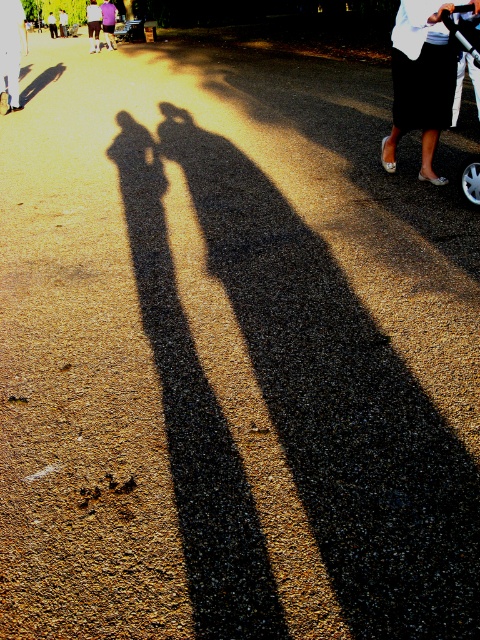
Who is positioned more to the left, black satin skirt at upper right or purple cotton shirt at upper left?

purple cotton shirt at upper left

Is black satin skirt at upper right shorter than purple cotton shirt at upper left?

Yes, black satin skirt at upper right is shorter than purple cotton shirt at upper left.

Locate an element on the screen. This screenshot has width=480, height=640. black satin skirt at upper right is located at coordinates coord(420,81).

Is point (408, 116) farther from camera compared to point (66, 13)?

No.

Consider the image. Can you confirm if black satin skirt at upper right is taller than white cotton shirt at center?

In fact, black satin skirt at upper right may be shorter than white cotton shirt at center.

Which is behind, point (428, 120) or point (63, 35)?

Point (63, 35)

This screenshot has height=640, width=480. What are the coordinates of `black satin skirt at upper right` in the screenshot? It's located at (420, 81).

Does white plastic baby carriage at upper right appear under purple cotton shirt at upper left?

Yes.

Who is more forward, (459, 22) or (92, 17)?

Point (459, 22) is in front.

This screenshot has width=480, height=640. I want to click on white plastic baby carriage at upper right, so click(464, 36).